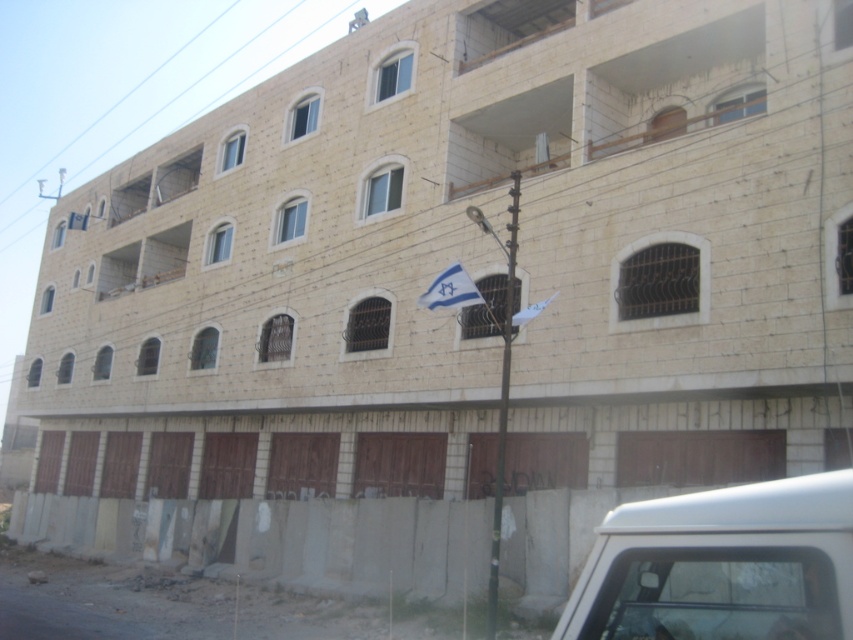
Who is shorter, black metal pole at center or blue fabric flag at center?

With less height is blue fabric flag at center.

The width and height of the screenshot is (853, 640). Identify the location of black metal pole at center. (503, 403).

Who is more forward, (503,410) or (465,276)?

Point (465,276) is more forward.

At what (x,y) coordinates should I click in order to perform the action: click on black metal pole at center. Please return your answer as a coordinate pair (x, y). Looking at the image, I should click on (503, 403).

Between blue fabric flag at center and white fabric flag at center, which one has more height?

With more height is white fabric flag at center.

Between blue fabric flag at center and white fabric flag at center, which one appears on the right side from the viewer's perspective?

white fabric flag at center is more to the right.

Is point (454, 300) positioned before point (531, 316)?

Yes, point (454, 300) is in front of point (531, 316).

This screenshot has width=853, height=640. In order to click on blue fabric flag at center in this screenshot , I will do `click(450, 291)`.

Who is lower down, black metal pole at center or white fabric flag at center?

black metal pole at center

Which of these two, black metal pole at center or white fabric flag at center, stands shorter?

white fabric flag at center is shorter.

Image resolution: width=853 pixels, height=640 pixels. What do you see at coordinates (503, 403) in the screenshot?
I see `black metal pole at center` at bounding box center [503, 403].

Find the location of a particular element. This screenshot has width=853, height=640. black metal pole at center is located at coordinates (503, 403).